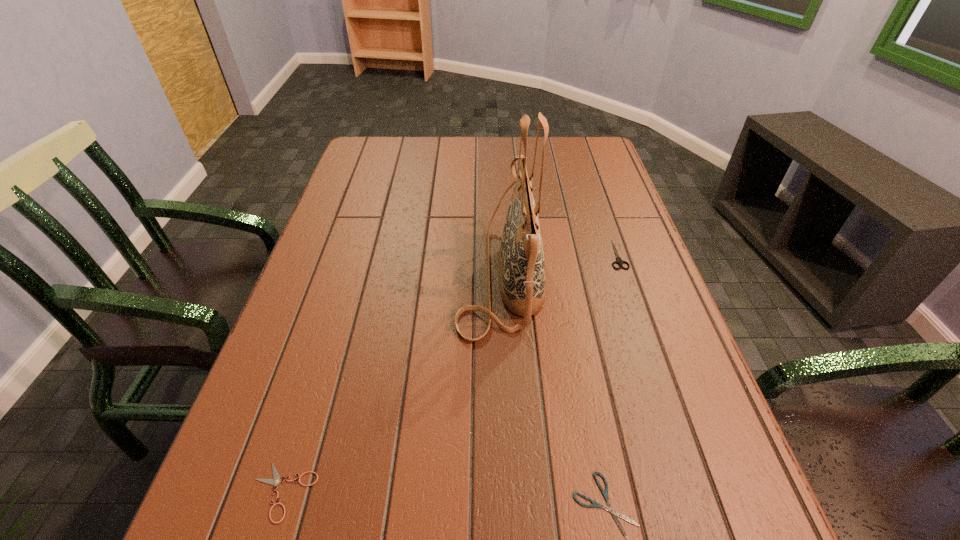
This screenshot has width=960, height=540. What are the coordinates of `handbag` in the screenshot? It's located at (521, 257).

In order to click on the farthest shears in this screenshot , I will do tap(619, 261).

Where is `the tallest shears`? This screenshot has width=960, height=540. the tallest shears is located at coordinates (619, 261).

I want to click on the leftmost shears, so 276,481.

You are a GUI agent. You are given a task and a screenshot of the screen. Output one action in this format:
    pyautogui.click(x=<x>, y=<y>)
    Task: Click on the vacant space positioned on the front-facing side of the tallest object
    
    Given the screenshot: What is the action you would take?
    pyautogui.click(x=351, y=275)

Where is `vacant region located on the front-facing side of the tallest object`? Image resolution: width=960 pixels, height=540 pixels. vacant region located on the front-facing side of the tallest object is located at coordinates (428, 275).

This screenshot has width=960, height=540. What are the coordinates of `vacant space located 0.240m on the front-facing side of the tallest object` in the screenshot? It's located at (356, 275).

Locate an element on the screen. free space located 0.370m on the left of the second tallest object is located at coordinates (459, 254).

Identify the location of vacant position located 0.180m on the back of the leftmost shears. (321, 369).

Where is `object that is positioned at the left edge`? This screenshot has width=960, height=540. object that is positioned at the left edge is located at coordinates (276, 481).